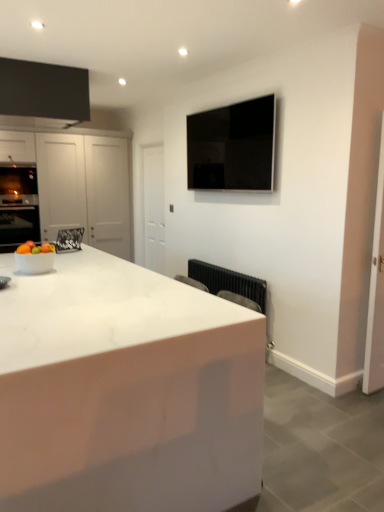
The image size is (384, 512). I want to click on vacant space underneath black glossy tv at upper center (from a real-world perspective), so click(232, 266).